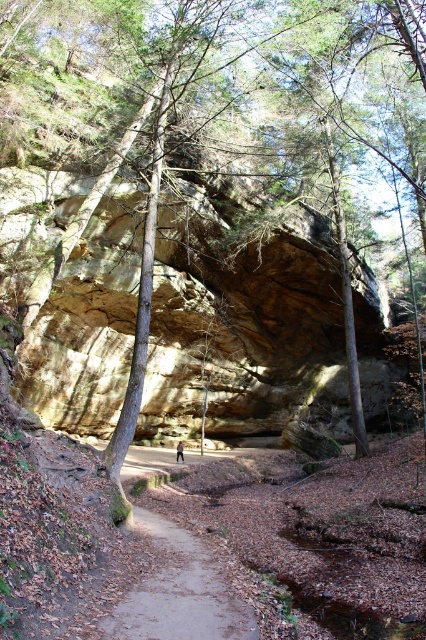
Question: Which point is farther to the camera?

Choices:
 (A) blue fabric person at center
 (B) brown dirt path at center

Answer: (A)

Question: Does brown dirt path at center appear over blue fabric person at center?

Choices:
 (A) no
 (B) yes

Answer: (B)

Question: Can you confirm if brown dirt path at center is thinner than blue fabric person at center?

Choices:
 (A) no
 (B) yes

Answer: (A)

Question: Can you confirm if brown dirt path at center is thinner than blue fabric person at center?

Choices:
 (A) yes
 (B) no

Answer: (B)